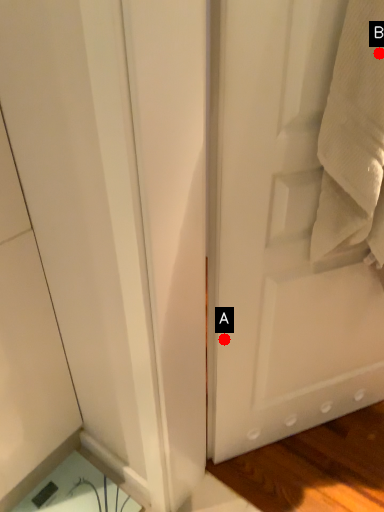
Question: Two points are circled on the image, labeled by A and B beside each circle. Which point appears closest to the camera in this image?

Choices:
 (A) A is closer
 (B) B is closer

Answer: (B)